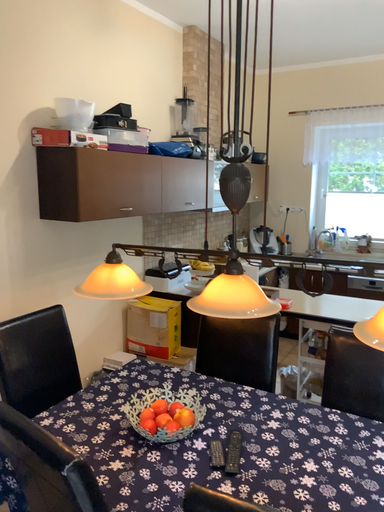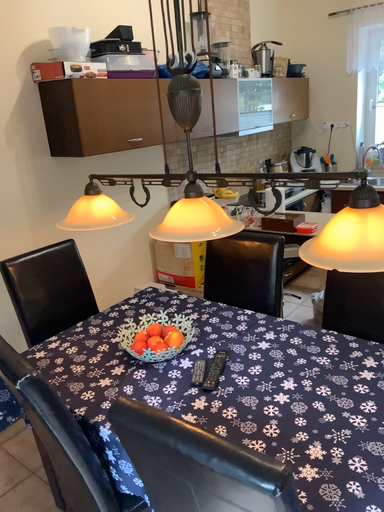
Question: Which way did the camera rotate in the video?

Choices:
 (A) rotated right
 (B) rotated left

Answer: (B)